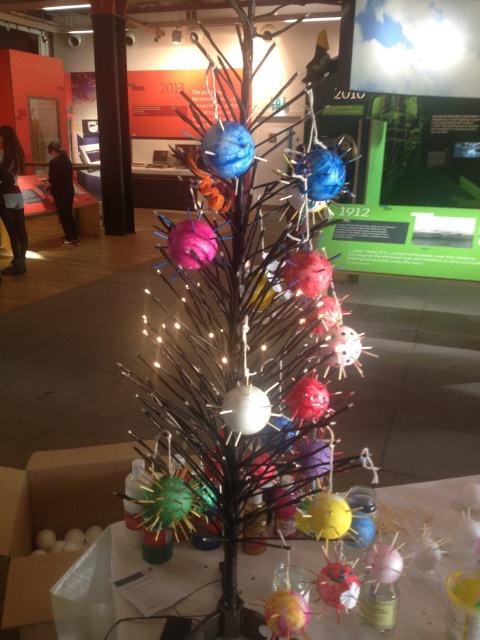
Is metallic wire tree at center bigger than translucent plastic table at lower center?

Yes, metallic wire tree at center is bigger than translucent plastic table at lower center.

Image resolution: width=480 pixels, height=640 pixels. What do you see at coordinates (243, 342) in the screenshot? I see `metallic wire tree at center` at bounding box center [243, 342].

From the picture: Measure the distance between metallic wire tree at center and camera.

A distance of 27.10 inches exists between metallic wire tree at center and camera.

Locate an element on the screen. This screenshot has width=480, height=640. metallic wire tree at center is located at coordinates (243, 342).